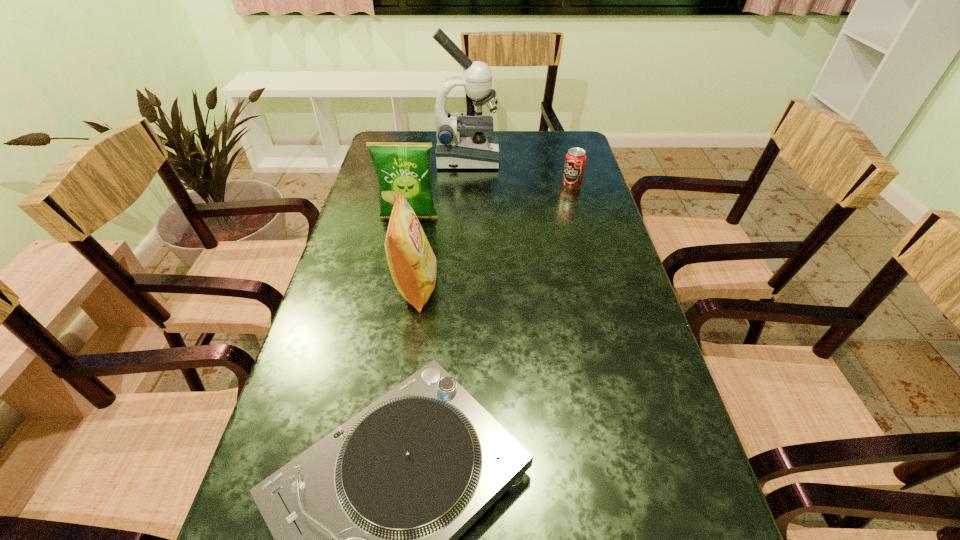
Identify which object is the second nearest to the second farthest object. Please provide its 2D coordinates. Your answer should be formatted as a tuple, i.e. [(x, y)], where the tuple contains the x and y coordinates of a point satisfying the conditions above.

[(406, 166)]